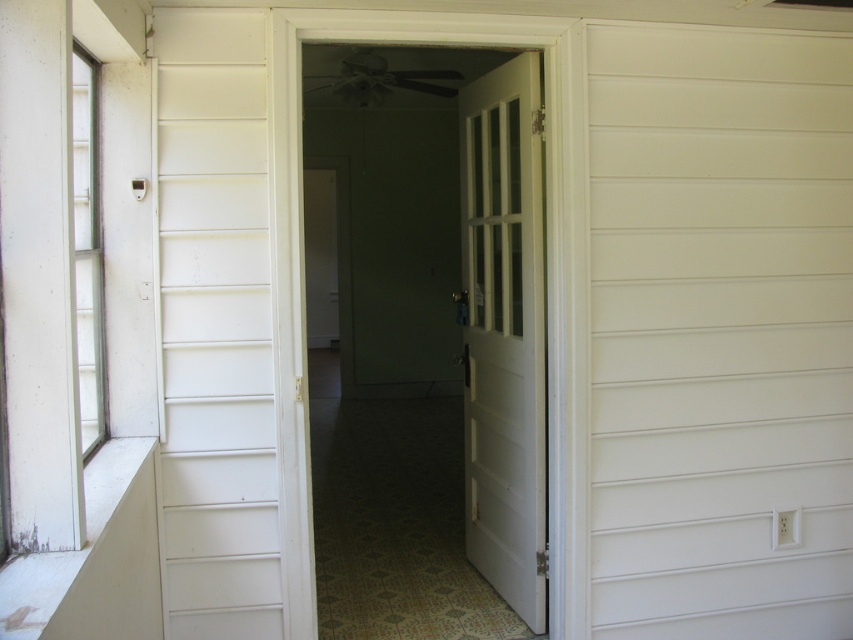
You are a delivery person trying to enter the house. You see two doors in the hallway. The white glossy door at center and the white wooden door at center. Which door should you go through to enter the house?

The white glossy door at center is above the white wooden door at center, so the white wooden door at center is the lower one and likely the entrance. You should go through the white wooden door at center to enter the house.

You are standing outside the house looking into the hallway. There are two points marked in the image, one at coordinates point (354, 273) and the other at point (90, 218). Which point is closer to you?

Point (90, 218) is closer to you because it is less further to the viewer than point (354, 273).